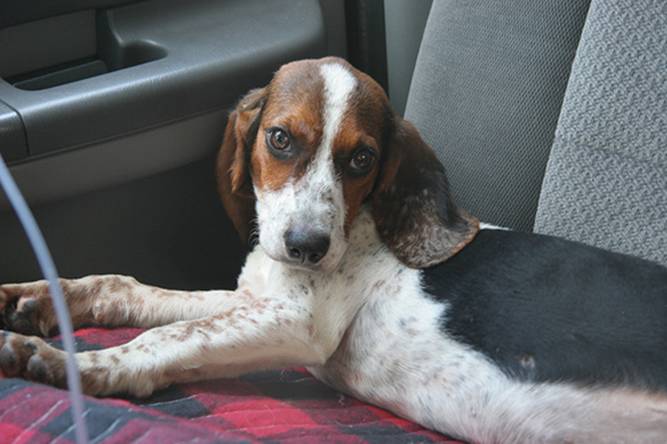
Identify the location of dark grey back of chair outside edge. (501, 89).